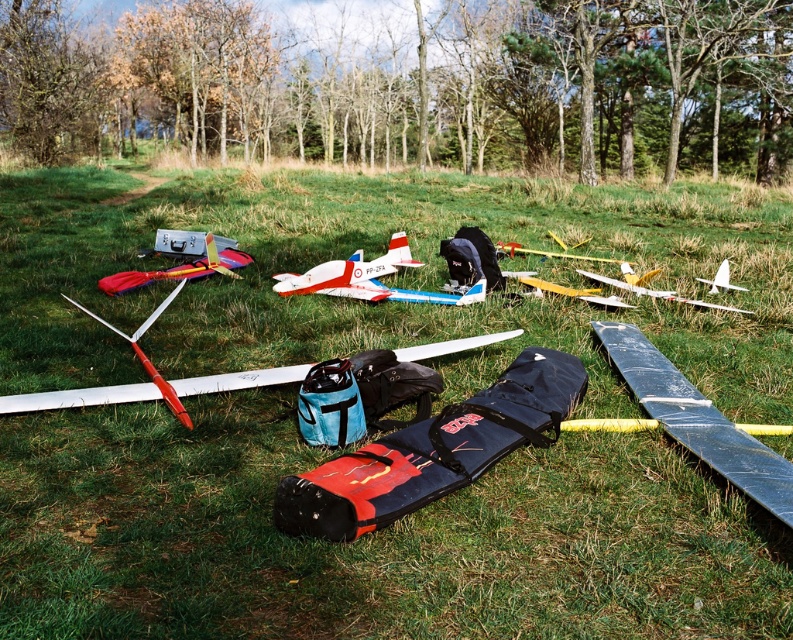
Question: Which object is farther from the camera taking this photo?

Choices:
 (A) red and white plastic airplane at center
 (B) shiny metallic wing at lower right
 (C) yellow matte airplane at center

Answer: (C)

Question: Estimate the real-world distances between objects in this image. Which object is closer to the white matte glider at center-right?

Choices:
 (A) matte black airplane at center
 (B) matte white airplane at center

Answer: (A)

Question: Which of the following is the farthest from the observer?

Choices:
 (A) yellow matte airplane at center
 (B) shiny metallic wing at lower right
 (C) red and white plastic airplane at center
 (D) white matte glider at center-right

Answer: (D)

Question: Is white matte airplane at center-right closer to camera compared to white matte glider at center-right?

Choices:
 (A) no
 (B) yes

Answer: (B)

Question: Considering the relative positions of black matte bag at center and blue fabric bag at center in the image provided, where is black matte bag at center located with respect to blue fabric bag at center?

Choices:
 (A) right
 (B) left

Answer: (A)

Question: Is blue fabric bag at center closer to the viewer compared to white matte glider at center-right?

Choices:
 (A) yes
 (B) no

Answer: (A)